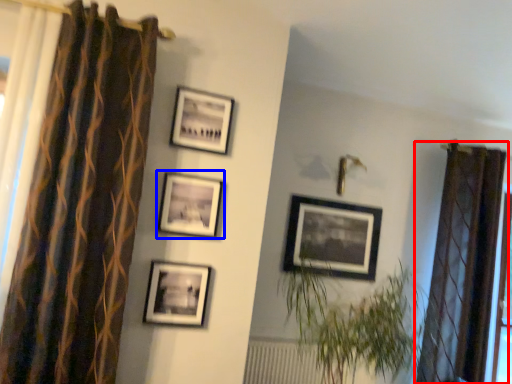
Question: Which object appears farthest to the camera in this image, curtain (highlighted by a red box) or picture frame (highlighted by a blue box)?

Choices:
 (A) curtain
 (B) picture frame

Answer: (A)